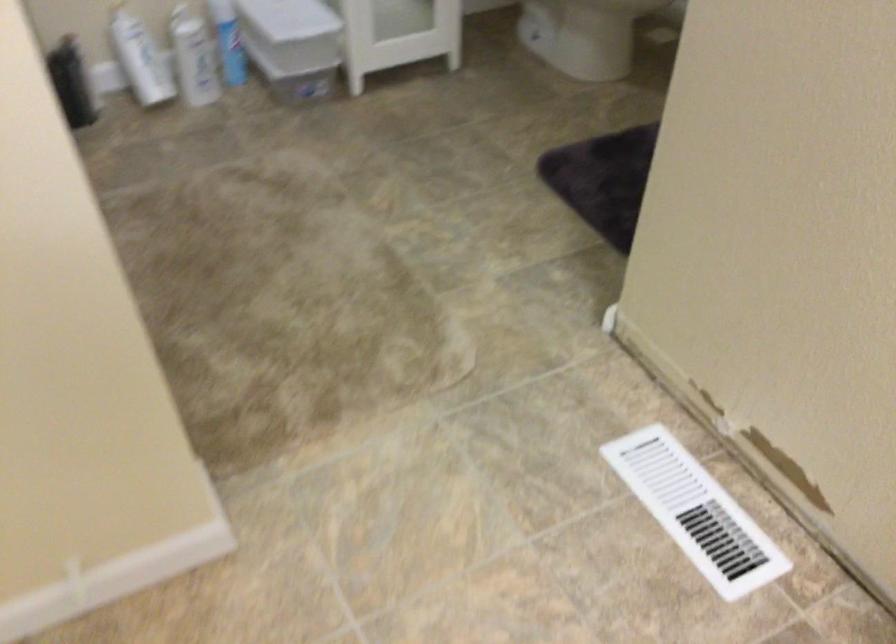
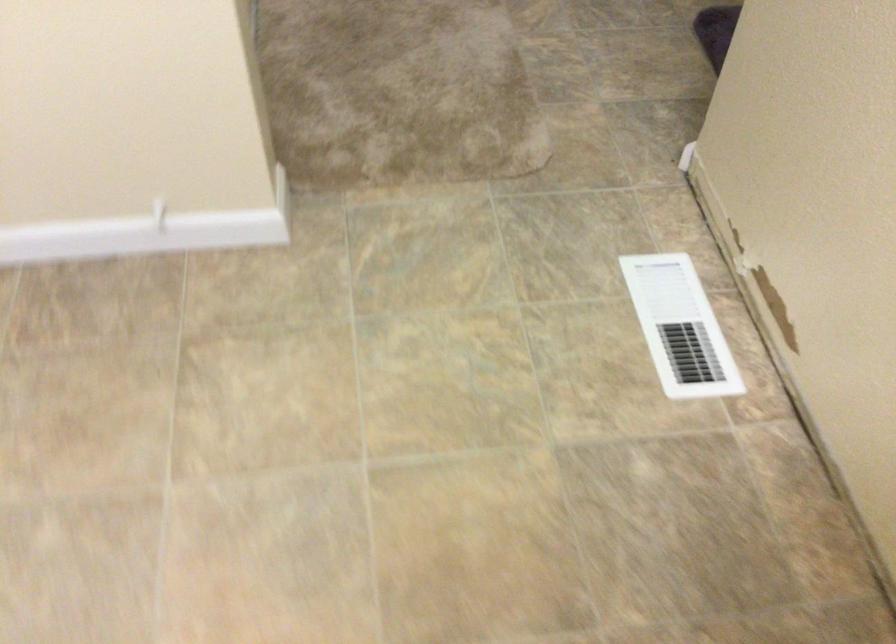
Question: The first image is from the beginning of the video and the second image is from the end. How did the camera likely rotate when shooting the video?

Choices:
 (A) Left
 (B) Right
 (C) Up
 (D) Down

Answer: (A)